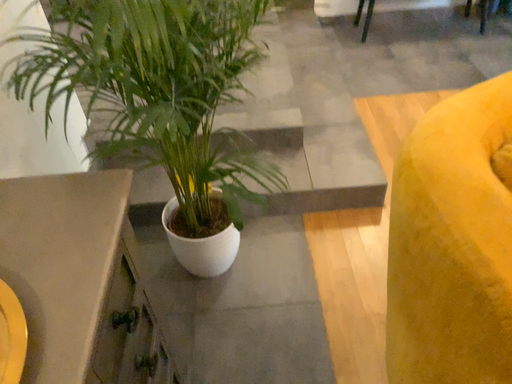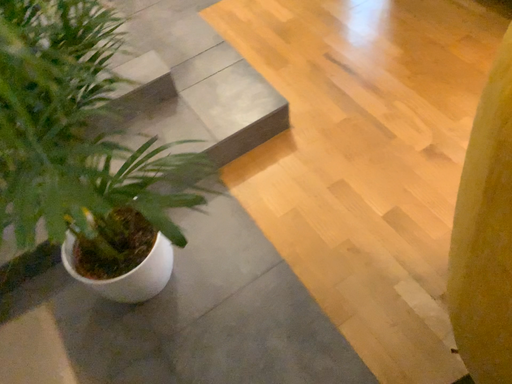
Question: How did the camera likely rotate when shooting the video?

Choices:
 (A) rotated right
 (B) rotated left

Answer: (A)